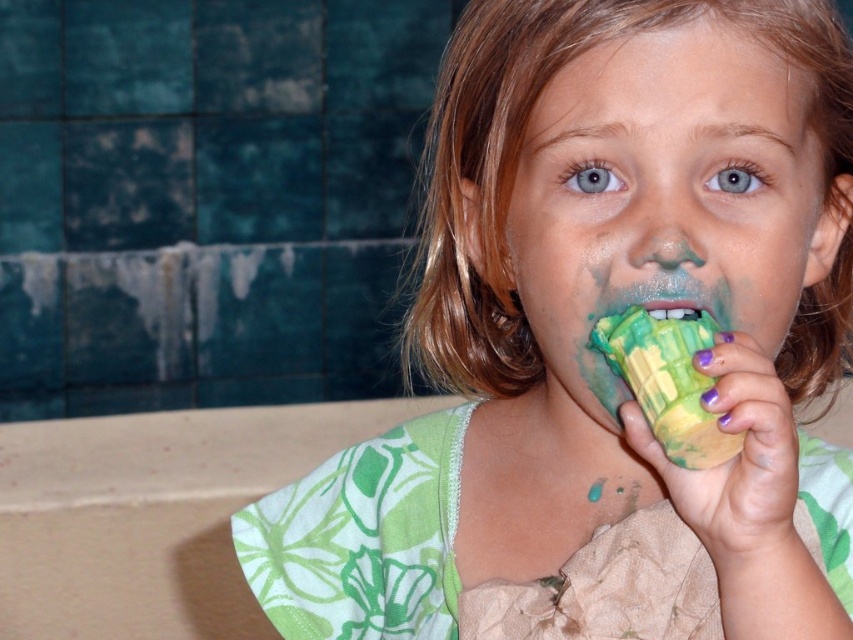
You are a painter trying to touch up the wall near the green painted cup at right. The point you need to paint is at coordinate (x=735, y=456). Is this point located on the green painted cup at right?

Yes, the point at coordinate (x=735, y=456) is on the green painted cup at right, so you should paint there.

You are a food delivery robot that needs to place a new dessert between the green matte cupcake at center and the green matte ice cream at center. The robot has a 7 cm long arm. Can the robot place the dessert between them without moving either item?

The distance between the green matte cupcake at center and the green matte ice cream at center is 6.87 centimeters. Since the robot has a 7 cm long arm, it can reach the space between them to place the dessert without moving either item.